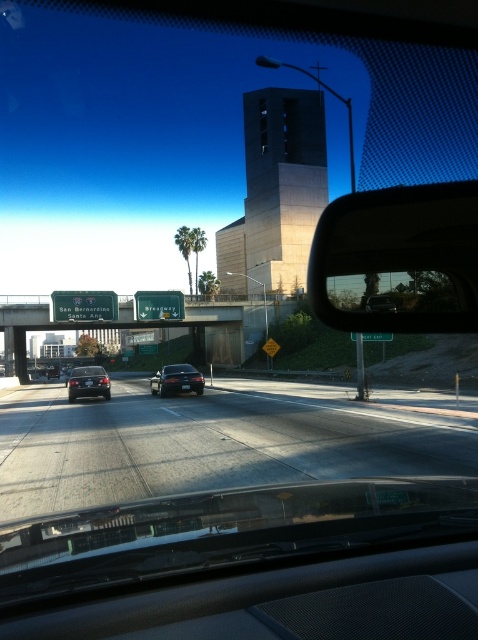
In the scene shown: Is black asphalt highway at center bigger than black plastic side mirror at center-right?

No, black asphalt highway at center is not bigger than black plastic side mirror at center-right.

Between point (156, 492) and point (452, 273), which one is positioned behind?

Positioned behind is point (156, 492).

Locate an element on the screen. black asphalt highway at center is located at coordinates (215, 442).

Does black plastic side mirror at center-right have a greater height compared to green matte highway sign at upper left?

Yes.

Who is more distant from viewer, (346, 225) or (72, 321)?

The point (72, 321) is more distant.

At what (x,y) coordinates should I click in order to perform the action: click on black plastic side mirror at center-right. Please return your answer as a coordinate pair (x, y). This screenshot has height=640, width=478. Looking at the image, I should click on click(x=398, y=259).

Can you confirm if satin black sedan at center is taller than shiny black sedan at center?

Yes.

Who is more forward, (202, 376) or (73, 397)?

Point (73, 397) is more forward.

Find the location of `satin black sedan at center`. satin black sedan at center is located at coordinates tap(176, 380).